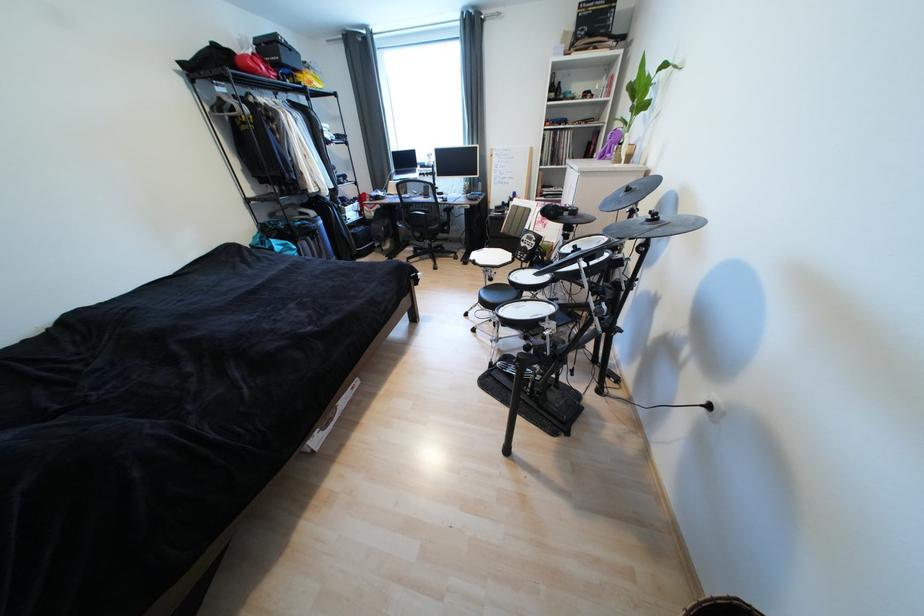
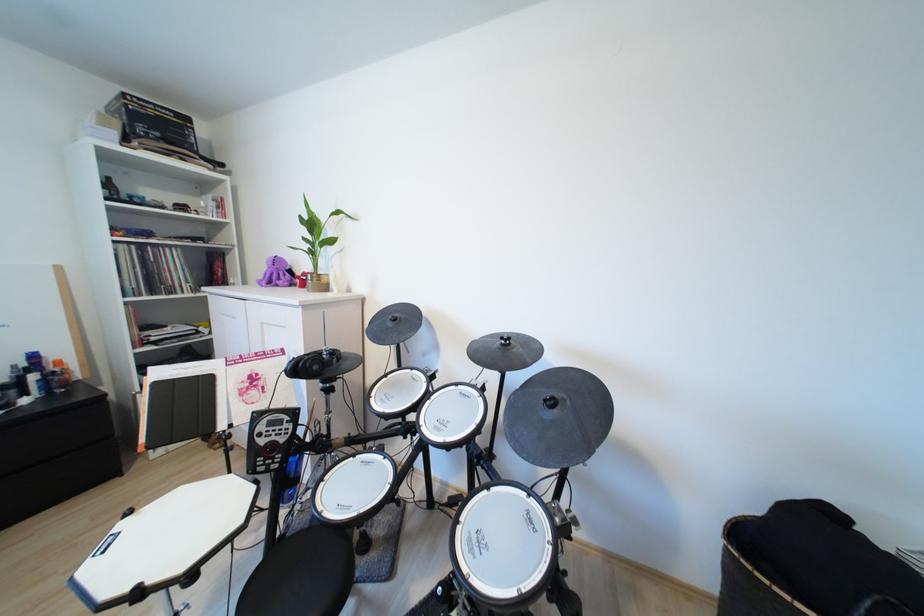
Locate, in the second image, the point that corresponds to pixel 628 196 in the first image.

(396, 325)